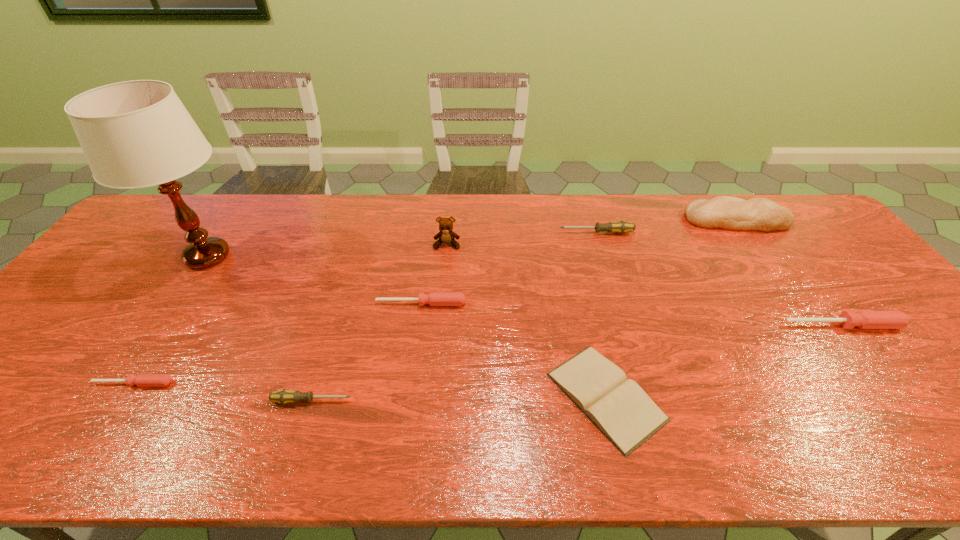
Find the location of `vacant space at the right edge of the desktop`. vacant space at the right edge of the desktop is located at coordinates (833, 270).

Identify the location of vacant space in between the brown table lamp and the fourth screwdriver from left to right. The height and width of the screenshot is (540, 960). (402, 245).

Find the location of `empty location between the right gray screwdriver and the bread`. empty location between the right gray screwdriver and the bread is located at coordinates (666, 226).

I want to click on free area in between the tallest object and the bread, so click(x=472, y=238).

The image size is (960, 540). I want to click on free space between the bread and the rightmost red screwdriver, so click(x=789, y=273).

Locate an element on the screen. The width and height of the screenshot is (960, 540). empty space that is in between the tallest object and the right gray screwdriver is located at coordinates (x=402, y=245).

This screenshot has width=960, height=540. I want to click on free spot between the leftmost red screwdriver and the biggest red screwdriver, so click(x=488, y=354).

Identify the location of empty space between the farthest screwdriver and the second tallest object. (521, 239).

In order to click on vacant space in between the farthest screwdriver and the Bible in this screenshot , I will do `click(601, 314)`.

The height and width of the screenshot is (540, 960). What are the coordinates of `vacant area that lies between the tallest object and the third tallest object` in the screenshot? It's located at (472, 238).